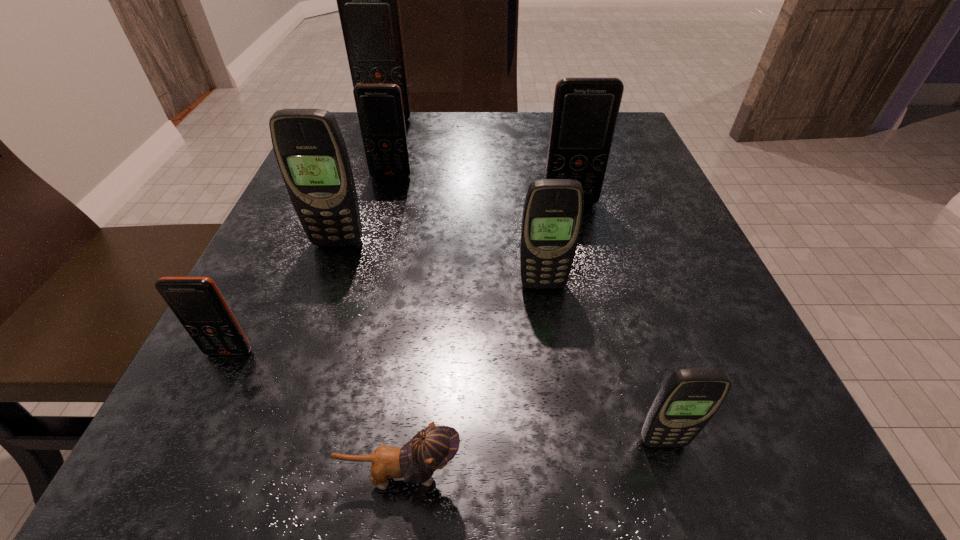
Where is `free space located on the screen of the second farthest cellular telephone`? The height and width of the screenshot is (540, 960). free space located on the screen of the second farthest cellular telephone is located at coordinates (383, 206).

Find the location of a particular element. vacant space located on the screen of the second nearest cellular telephone is located at coordinates (155, 508).

At what (x,y) coordinates should I click in order to perform the action: click on vacant space located 0.050m on the screen of the second nearest object. Please return your answer as a coordinate pair (x, y). This screenshot has height=540, width=960. Looking at the image, I should click on (679, 496).

Locate an element on the screen. free space located on the front-facing side of the kitten is located at coordinates (757, 475).

The width and height of the screenshot is (960, 540). I want to click on object located at the far edge, so click(x=368, y=0).

Where is `cellular telephone located in the near edge section of the desktop`? cellular telephone located in the near edge section of the desktop is located at coordinates (689, 398).

Find the location of a particular element. The image size is (960, 540). kitten that is at the near edge is located at coordinates (433, 447).

Locate an element on the screen. object present at the far left corner is located at coordinates (368, 0).

Locate an element on the screen. object situated at the near right corner is located at coordinates (689, 398).

The image size is (960, 540). I want to click on free region at the far edge of the desktop, so click(471, 130).